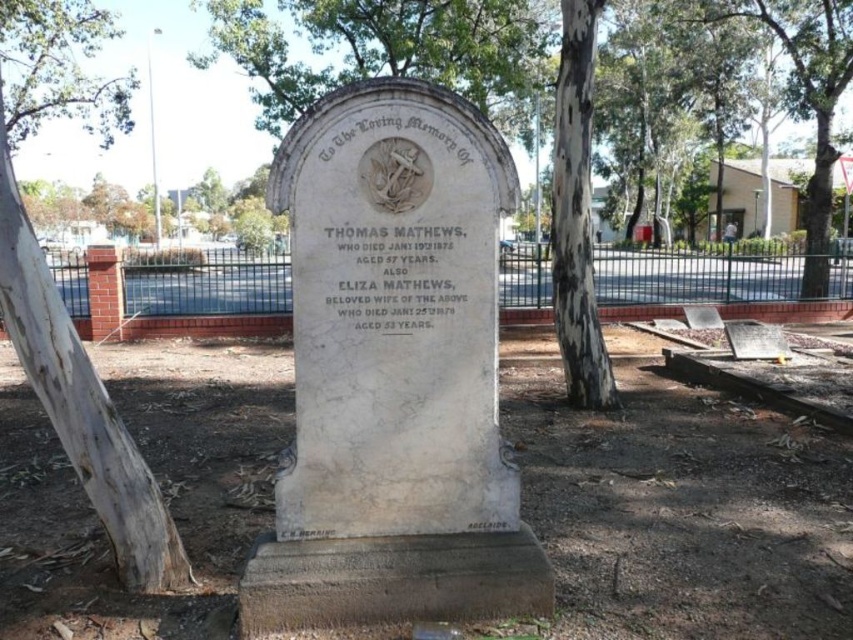
You are standing in front of the gravestone and want to know which tree is wider. Can you determine which one is wider between the white bark tree at center and the green leafy tree at upper left?

The white bark tree at center is wider than the green leafy tree at upper left.